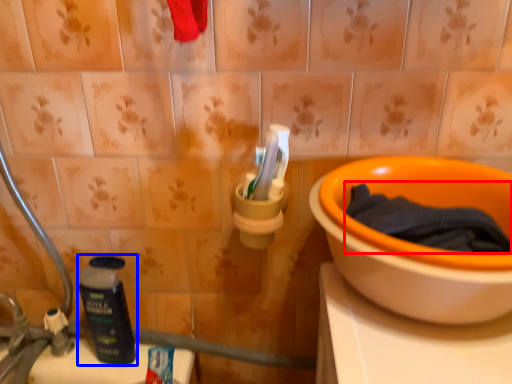
Question: Which object appears closest to the camera in this image, bath towel (highlighted by a red box) or bottle (highlighted by a blue box)?

Choices:
 (A) bath towel
 (B) bottle

Answer: (A)